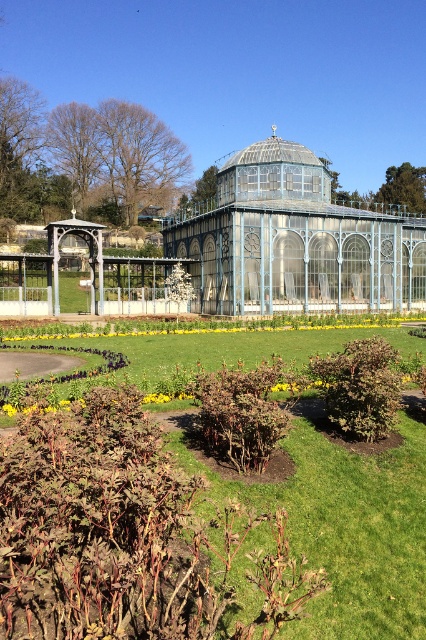
You are a gardener planning to install a new sprinkler system in the garden. The sprinkler needs to reach both the green leafy bush at center and the blue glass gazebo at center. Considering their heights, which object might require a taller sprinkler nozzle to ensure adequate water coverage?

The blue glass gazebo at center requires a taller sprinkler nozzle because it is taller than the green leafy bush at center.

Based on the photo, you are planning to place a new decorative statue that requires a base width of 2 meters. You have two options in the garden scene described. Which object between the green leafy bush at center and the blue glass gazebo at center can accommodate the statue if the statue needs a base wider than the object itself?

The blue glass gazebo at center is wider than the green leafy bush at center. Since the statue requires a base wider than the object, the statue can be placed at the blue glass gazebo at center.